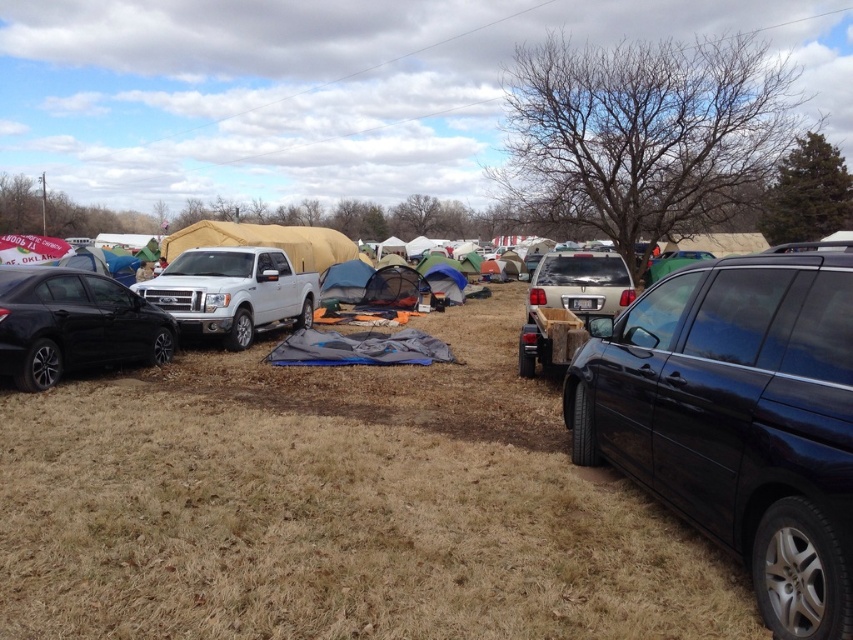
You are a hiker trying to set up a tent in the brown grassy field at center. You notice the shiny black sedan at left nearby. Which surface is lower in height between the two?

The brown grassy field at center is shorter than the shiny black sedan at left, so the grassy field is lower in height.

You are planning to park your car in this camping area. You see the black matte minivan at right and the white matte truck at center. Which vehicle takes up less space in the parking area?

The black matte minivan at right is smaller than the white matte truck at center, so it takes up less space in the parking area.

You are planning to set up a large tent in the brown grassy field at center. Considering the space available, will the black matte minivan at right be an obstacle when you need to move it out later?

The brown grassy field at center has a larger width than the black matte minivan at right, so there should be enough space to maneuver the minivan without obstruction from the field itself.